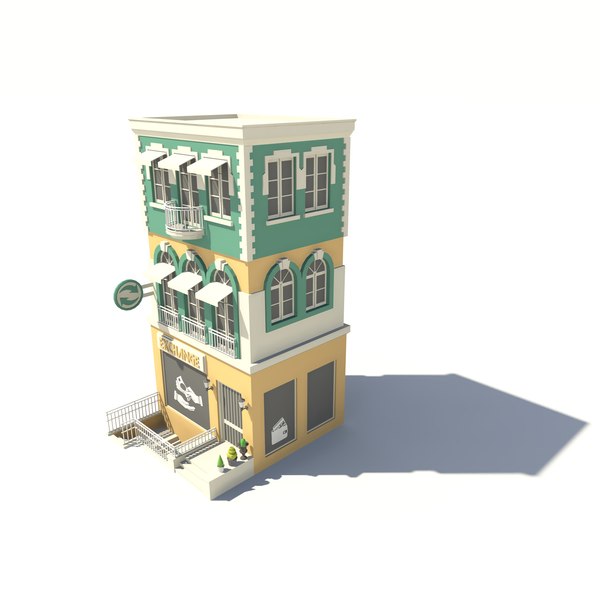
Identify the location of stairs. The image size is (600, 600). (165, 440).